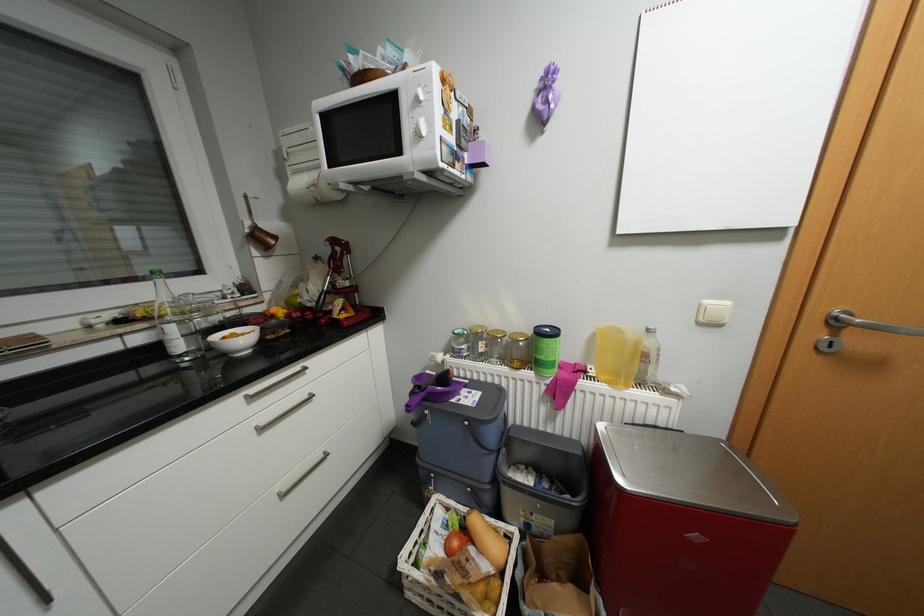
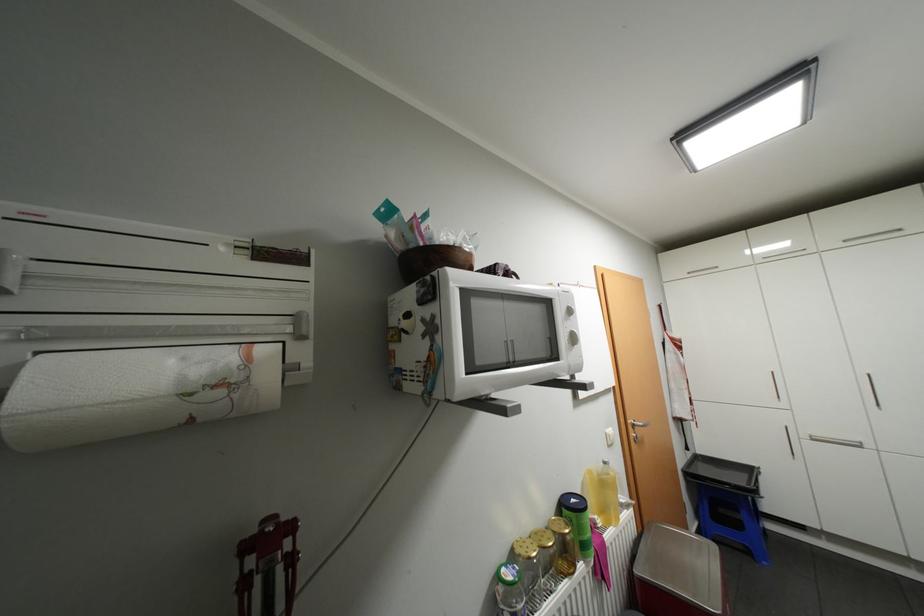
Find the pixel in the second image that matches (600,371) in the first image.

(606, 521)